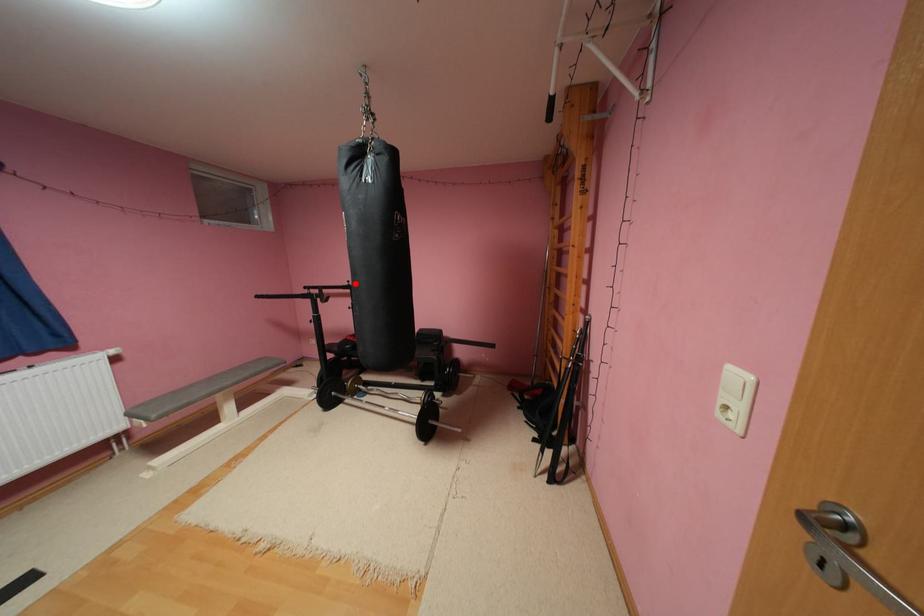
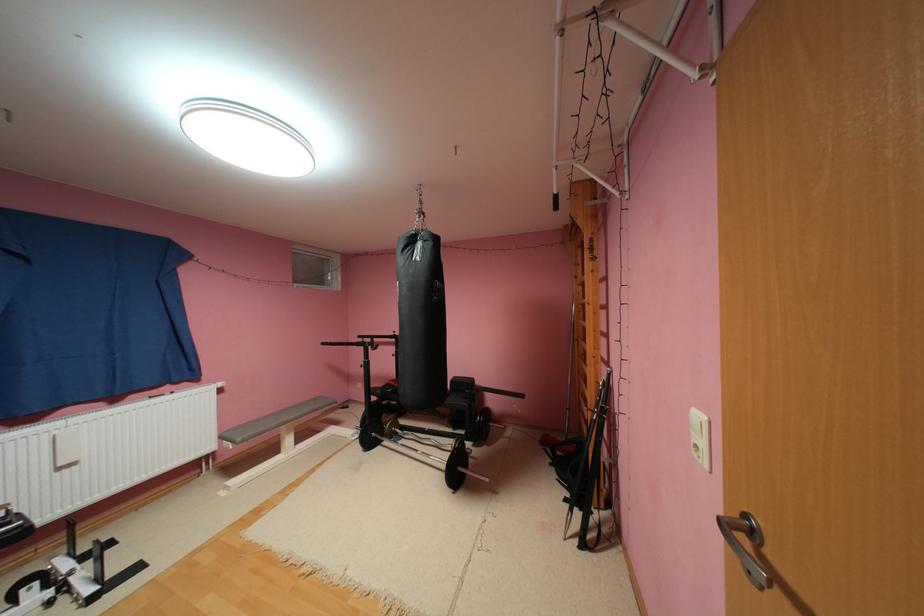
Find the pixel in the second image that matches the highlighted location in the first image.

(400, 334)